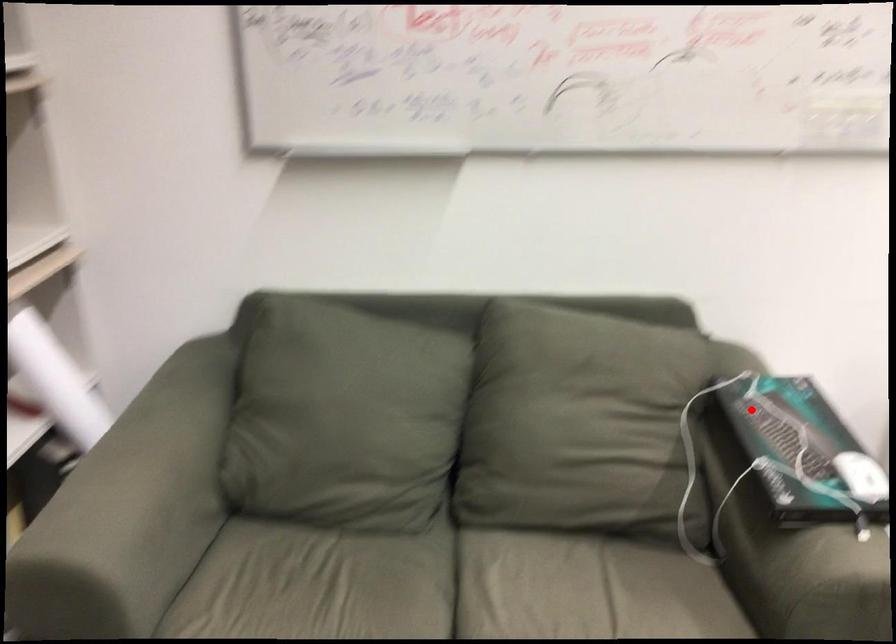
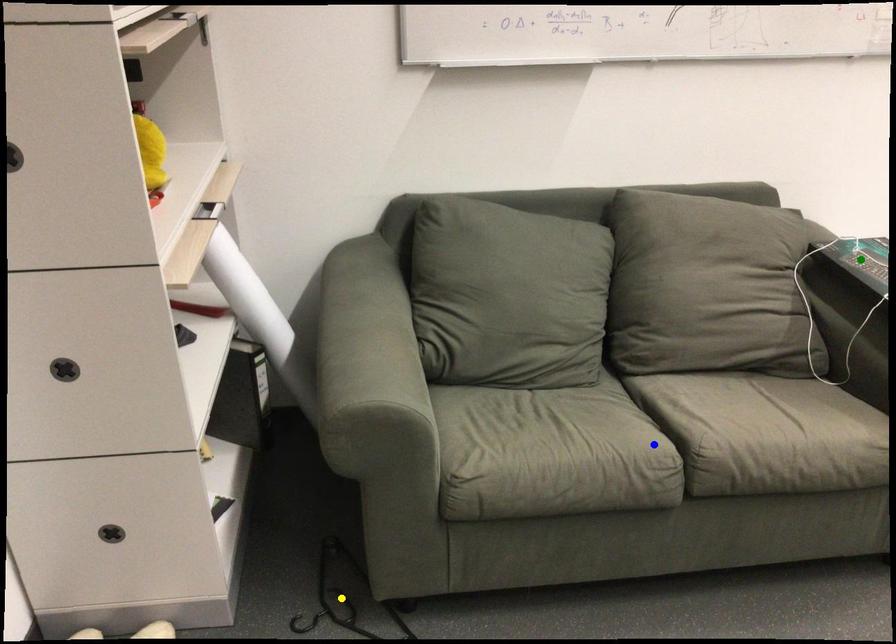
Question: I am providing you with two images of the same scene from different viewpoints. A red point is marked on the first image. You are given multiple points on the second image. Can you choose the point in image 2 that corresponds to the point in image 1?

Choices:
 (A) green point
 (B) blue point
 (C) yellow point

Answer: (A)